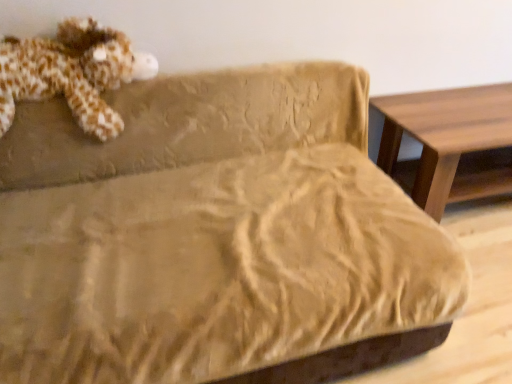
Where is `wooden table at right`? The image size is (512, 384). wooden table at right is located at coordinates (448, 140).

What is the approximate height of wooden table at right?

The height of wooden table at right is 20.07 inches.

What do you see at coordinates (448, 140) in the screenshot? I see `wooden table at right` at bounding box center [448, 140].

The width and height of the screenshot is (512, 384). What do you see at coordinates (72, 73) in the screenshot?
I see `fluffy brown plush at upper left` at bounding box center [72, 73].

Measure the distance between fluffy brown plush at upper left and camera.

A distance of 4.37 feet exists between fluffy brown plush at upper left and camera.

At what (x,y) coordinates should I click in order to perform the action: click on fluffy brown plush at upper left. Please return your answer as a coordinate pair (x, y). This screenshot has width=512, height=384. Looking at the image, I should click on (72, 73).

Image resolution: width=512 pixels, height=384 pixels. Identify the location of wooden table at right. (448, 140).

Would you say fluffy brown plush at upper left is to the left or to the right of wooden table at right in the picture?

From the image, it's evident that fluffy brown plush at upper left is to the left of wooden table at right.

Does fluffy brown plush at upper left lie behind wooden table at right?

No.

Which is in front, point (77, 30) or point (496, 194)?

The point (77, 30) is closer.

From the image's perspective, is fluffy brown plush at upper left positioned above or below wooden table at right?

fluffy brown plush at upper left is above wooden table at right.

From a real-world perspective, between fluffy brown plush at upper left and wooden table at right, who is vertically higher?

fluffy brown plush at upper left is physically above.

Which of these two, fluffy brown plush at upper left or wooden table at right, is wider?

wooden table at right.

Between fluffy brown plush at upper left and wooden table at right, which one has less height?

wooden table at right is shorter.

Does fluffy brown plush at upper left have a smaller size compared to wooden table at right?

Yes, fluffy brown plush at upper left is smaller than wooden table at right.

Is fluffy brown plush at upper left not within wooden table at right?

Yes, fluffy brown plush at upper left is located beyond the bounds of wooden table at right.

Is fluffy brown plush at upper left beside wooden table at right?

No, fluffy brown plush at upper left is not making contact with wooden table at right.

Is wooden table at right at the back of fluffy brown plush at upper left?

That's not correct — fluffy brown plush at upper left is not looking away from wooden table at right.

The height and width of the screenshot is (384, 512). I want to click on table below the fluffy brown plush at upper left (from the image's perspective), so click(x=448, y=140).

Does wooden table at right appear on the left side of fluffy brown plush at upper left?

No.

Relative to fluffy brown plush at upper left, is wooden table at right in front or behind?

In the image, wooden table at right appears behind fluffy brown plush at upper left.

Is point (432, 213) closer to viewer compared to point (69, 38)?

No.

From the image's perspective, which one is positioned lower, wooden table at right or fluffy brown plush at upper left?

From the image's view, wooden table at right is below.

From a real-world perspective, which object rests below the other?

wooden table at right, from a real-world perspective.

Considering the relative sizes of wooden table at right and fluffy brown plush at upper left in the image provided, is wooden table at right thinner than fluffy brown plush at upper left?

In fact, wooden table at right might be wider than fluffy brown plush at upper left.

Which of these two, wooden table at right or fluffy brown plush at upper left, stands shorter?

wooden table at right is shorter.

Which of these two, wooden table at right or fluffy brown plush at upper left, is smaller?

fluffy brown plush at upper left is smaller.

Is wooden table at right not within fluffy brown plush at upper left?

wooden table at right lies outside fluffy brown plush at upper left's area.

Is wooden table at right far away from fluffy brown plush at upper left?

Absolutely, wooden table at right is distant from fluffy brown plush at upper left.

Is wooden table at right oriented towards fluffy brown plush at upper left?

No.

How many degrees apart are the facing directions of wooden table at right and fluffy brown plush at upper left?

The facing directions of wooden table at right and fluffy brown plush at upper left are 0.0198 degrees apart.

Locate an element on the screen. The height and width of the screenshot is (384, 512). table below the fluffy brown plush at upper left (from the image's perspective) is located at coordinates (448, 140).

The image size is (512, 384). In order to click on toy in front of the wooden table at right in this screenshot , I will do `click(72, 73)`.

Locate an element on the screen. This screenshot has width=512, height=384. table to the right of fluffy brown plush at upper left is located at coordinates (448, 140).